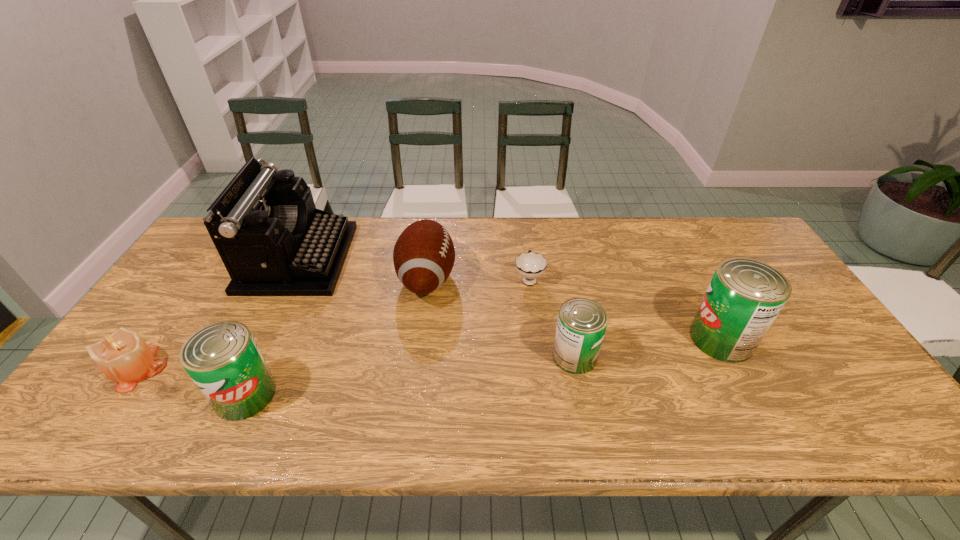
Where is `object positioned at the near left corner`? object positioned at the near left corner is located at coordinates (123, 356).

Identify the location of vacant space at the far edge. (476, 237).

At what (x,y) coordinates should I click in order to perform the action: click on free space at the near edge of the desktop. Please return your answer as a coordinate pair (x, y). Looking at the image, I should click on (517, 396).

This screenshot has height=540, width=960. I want to click on free space at the far right corner of the desktop, so click(722, 225).

This screenshot has width=960, height=540. Find the location of `free spot between the football and the typewriter`. free spot between the football and the typewriter is located at coordinates (363, 268).

Locate an element on the screen. free space between the typewriter and the candle is located at coordinates (219, 313).

Where is `vacant area between the rightmost can and the second shortest can`? The height and width of the screenshot is (540, 960). vacant area between the rightmost can and the second shortest can is located at coordinates (484, 367).

The height and width of the screenshot is (540, 960). In order to click on vacant point located between the second tallest can and the shortest can in this screenshot , I will do `click(410, 375)`.

I want to click on vacant area that lies between the leftmost object and the rightmost can, so click(x=430, y=353).

The image size is (960, 540). I want to click on free space between the typewriter and the second shortest can, so click(272, 327).